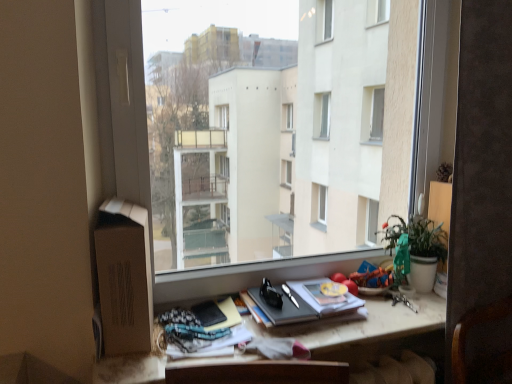
You are a GUI agent. You are given a task and a screenshot of the screen. Output one action in this format:
    pyautogui.click(x=<x>, y=<y>)
    Task: Click on the free space in front of matte black notebook at lower center, positioned as the second paperback book in right-to-left order
    
    Given the screenshot: What is the action you would take?
    pyautogui.click(x=205, y=352)